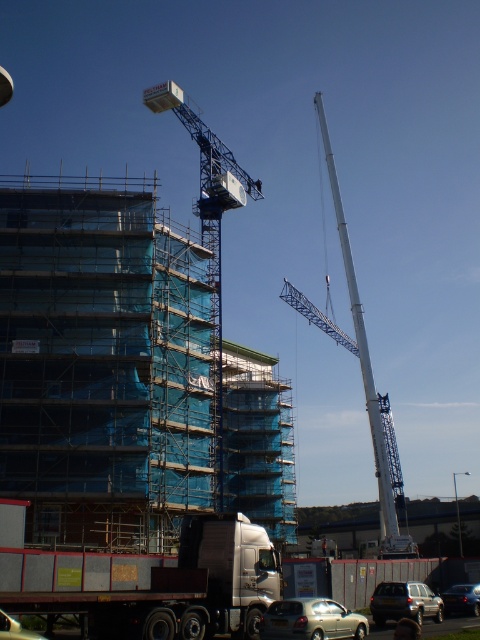
You are a construction worker standing at the point marked by the coordinates point (x=360, y=364). Looking around, you see the white metallic crane at center. Which direction should you walk to reach the large blue crane positioned to the right of the building?

The large blue crane positioned to the right of the building is located to the right side of the building, so from the point marked by point (x=360, y=364), you should walk towards the right to reach the large blue crane positioned to the right of the building.

From the picture: You are an engineer assessing the construction site. You need to determine which crane is shorter between the blue metallic crane at upper center and the white metallic crane at center. Which one is shorter?

The blue metallic crane at upper center is shorter than the white metallic crane at center.

You are a delivery driver arriving at the construction site. You need to park your truck at the lower left corner of the site. However, there is a point marked at coordinates point (156, 582). Is this point on the truck where you plan to park?

The point (156, 582) is on the metallic silver truck at lower left, so yes, the point is on the truck where you plan to park.